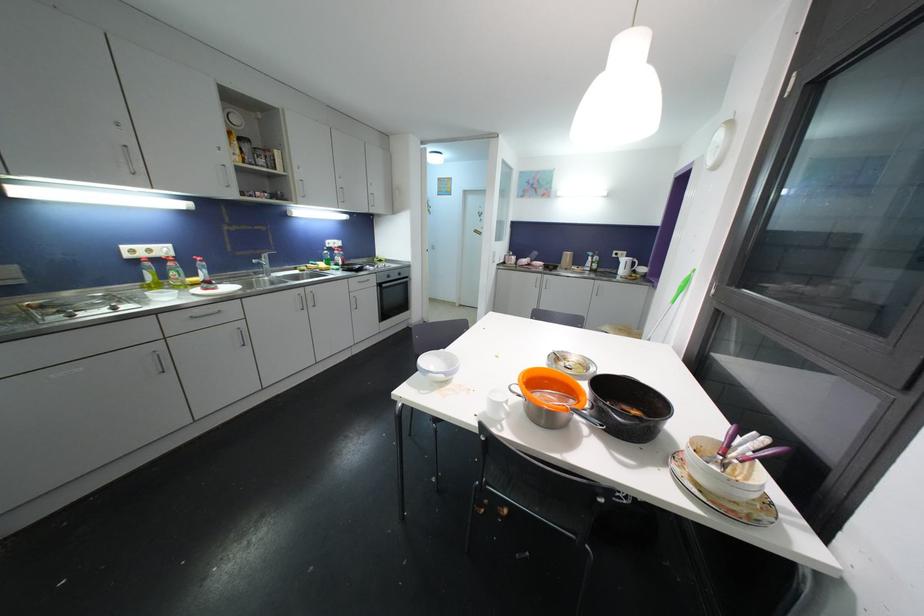
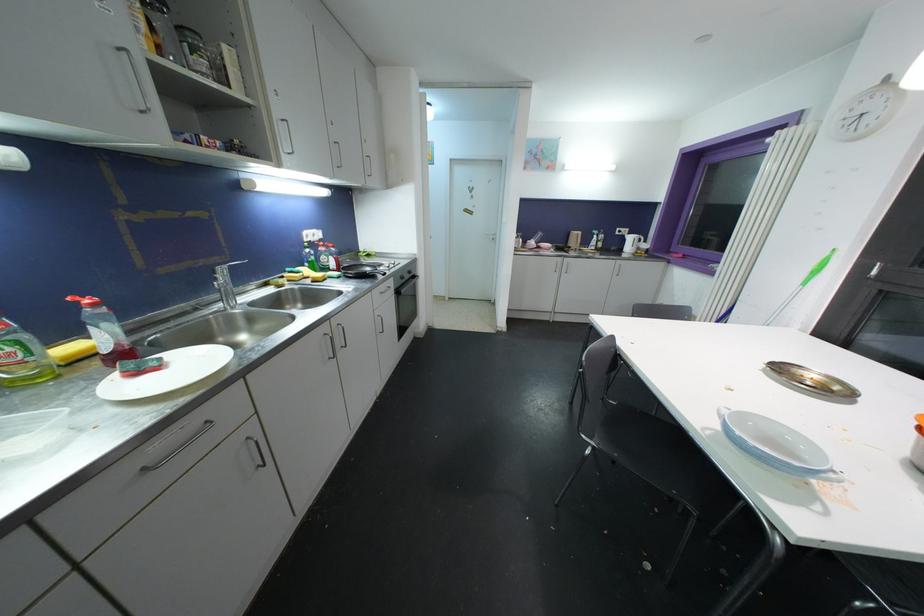
The point at (x=184, y=272) is marked in the first image. Where is the corresponding point in the second image?

(27, 339)